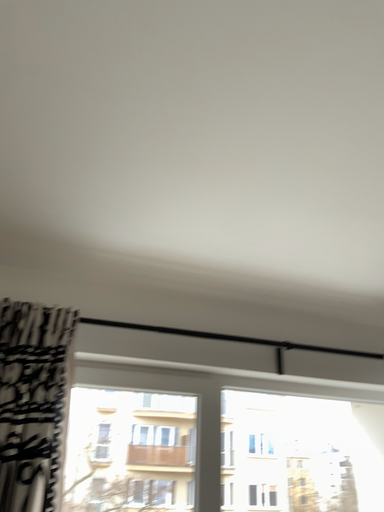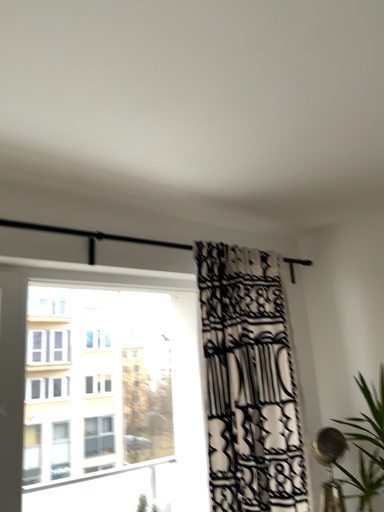
Question: Which way did the camera rotate in the video?

Choices:
 (A) rotated upward
 (B) rotated downward

Answer: (B)